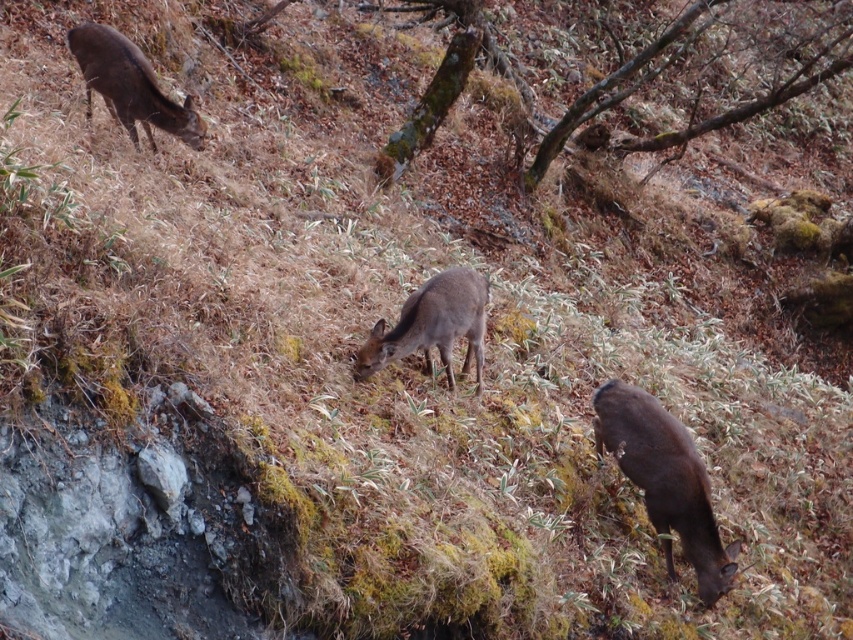
Question: Is brown matte deer at lower right smaller than brown matte deer at center?

Choices:
 (A) no
 (B) yes

Answer: (A)

Question: Is the position of brown matte deer at lower right less distant than that of brown matte deer at upper left?

Choices:
 (A) yes
 (B) no

Answer: (A)

Question: Which point is farther to the camera?

Choices:
 (A) (643, 422)
 (B) (367, 356)

Answer: (A)

Question: Is brown matte deer at lower right positioned in front of brown matte deer at center?

Choices:
 (A) yes
 (B) no

Answer: (A)

Question: Among these points, which one is nearest to the camera?

Choices:
 (A) (141, 61)
 (B) (426, 304)

Answer: (B)

Question: Which object is the farthest from the brown matte deer at upper left?

Choices:
 (A) brown matte deer at center
 (B) brown matte deer at lower right

Answer: (B)